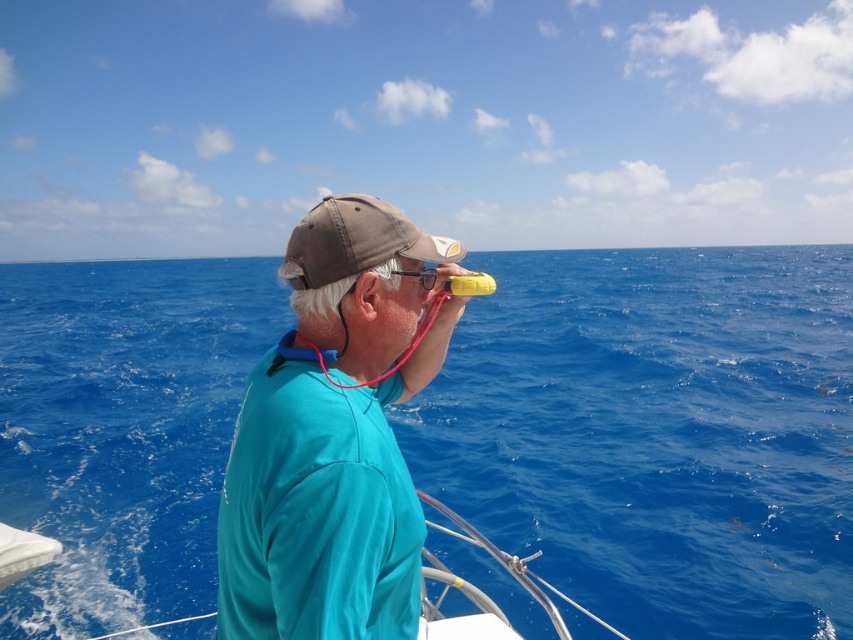
Question: Which object appears farthest from the camera in this image?

Choices:
 (A) brown cotton baseball cap at center
 (B) rubberized translucent goggles at center
 (C) teal fabric shirt at center

Answer: (B)

Question: Which of the following is the farthest from the observer?

Choices:
 (A) (457, 256)
 (B) (381, 621)
 (C) (566, 621)
 (D) (425, 268)

Answer: (C)

Question: Among these points, which one is farthest from the camera?

Choices:
 (A) (308, 518)
 (B) (764, 365)
 (C) (376, 232)
 (D) (426, 276)

Answer: (B)

Question: Is blue water at center above teal fabric shirt at center?

Choices:
 (A) yes
 (B) no

Answer: (A)

Question: Is teal fabric shirt at center further to the viewer compared to brown cotton baseball cap at center?

Choices:
 (A) no
 (B) yes

Answer: (A)

Question: Can you confirm if blue water at center is bigger than teal fabric shirt at center?

Choices:
 (A) no
 (B) yes

Answer: (B)